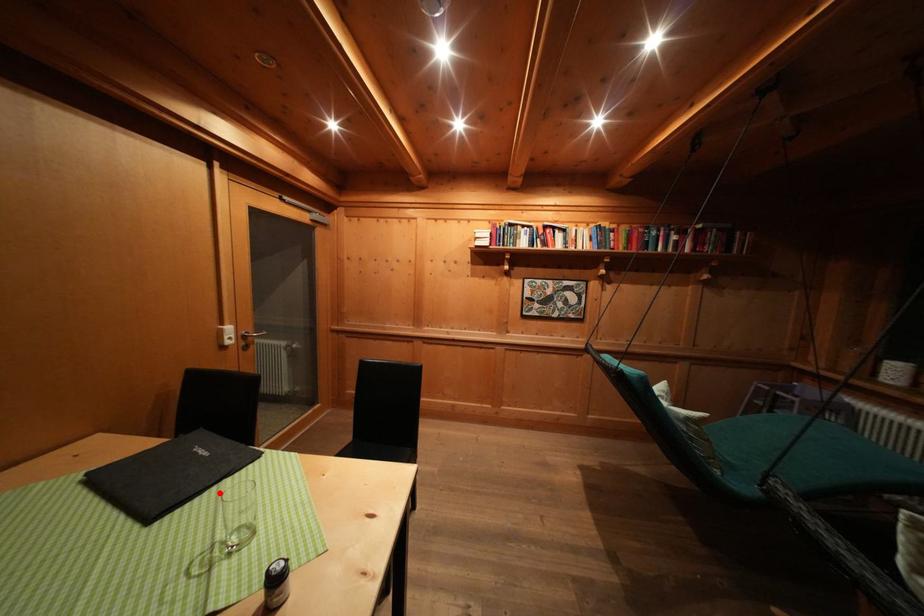
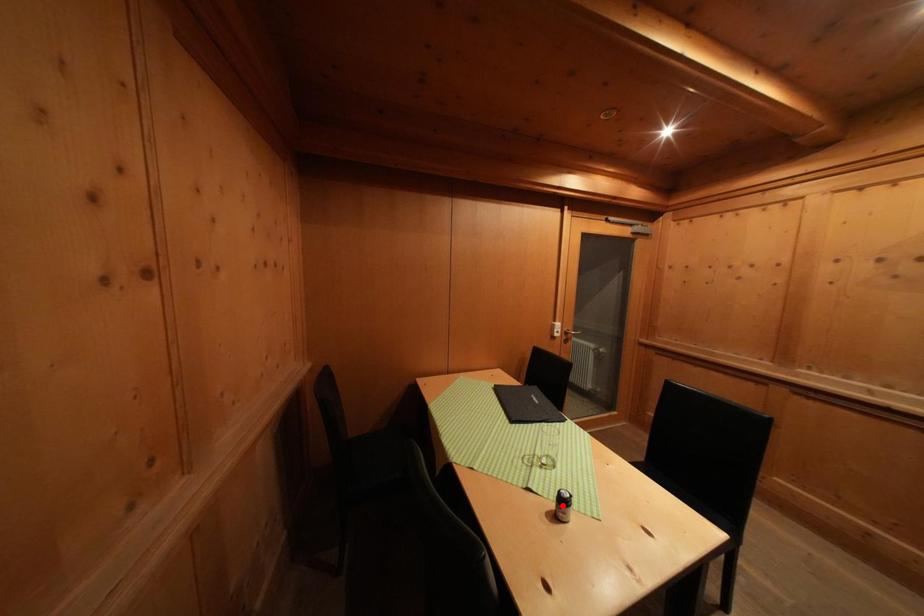
I am providing you with two images of the same scene from different viewpoints. A red point is marked on the first image and another point is marked on the second image. Do the highlighted points in image1 and image2 indicate the same real-world spot?

No